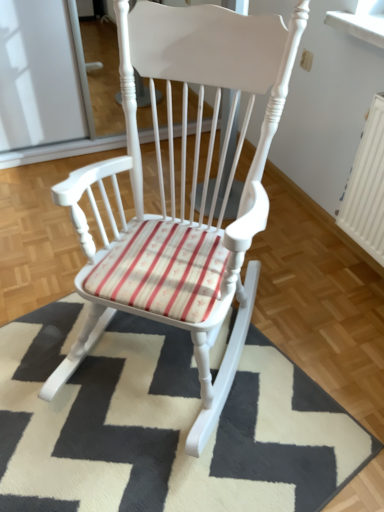
Question: Does white wood rocking chair at center have a lesser width compared to white textured mat at center?

Choices:
 (A) no
 (B) yes

Answer: (B)

Question: Considering the relative sizes of white wood rocking chair at center and white textured mat at center in the image provided, is white wood rocking chair at center wider than white textured mat at center?

Choices:
 (A) yes
 (B) no

Answer: (B)

Question: Can white textured mat at center be found inside white wood rocking chair at center?

Choices:
 (A) yes
 (B) no

Answer: (B)

Question: From the image's perspective, is white wood rocking chair at center located beneath white textured mat at center?

Choices:
 (A) no
 (B) yes

Answer: (A)

Question: From the image's perspective, is white wood rocking chair at center above white textured mat at center?

Choices:
 (A) yes
 (B) no

Answer: (A)

Question: Is white wood rocking chair at center oriented away from white textured mat at center?

Choices:
 (A) yes
 (B) no

Answer: (B)

Question: Is white textured mat at center at the right side of white wood rocking chair at center?

Choices:
 (A) no
 (B) yes

Answer: (A)

Question: Can you confirm if white textured mat at center is smaller than white wood rocking chair at center?

Choices:
 (A) no
 (B) yes

Answer: (B)

Question: Does white textured mat at center appear on the left side of white wood rocking chair at center?

Choices:
 (A) yes
 (B) no

Answer: (A)

Question: Can you confirm if white textured mat at center is shorter than white wood rocking chair at center?

Choices:
 (A) yes
 (B) no

Answer: (A)

Question: Is white textured mat at center not within white wood rocking chair at center?

Choices:
 (A) yes
 (B) no

Answer: (A)

Question: From the image's perspective, would you say white textured mat at center is shown under white wood rocking chair at center?

Choices:
 (A) no
 (B) yes

Answer: (B)

Question: Is white textured mat at center wider or thinner than white wood rocking chair at center?

Choices:
 (A) wide
 (B) thin

Answer: (A)